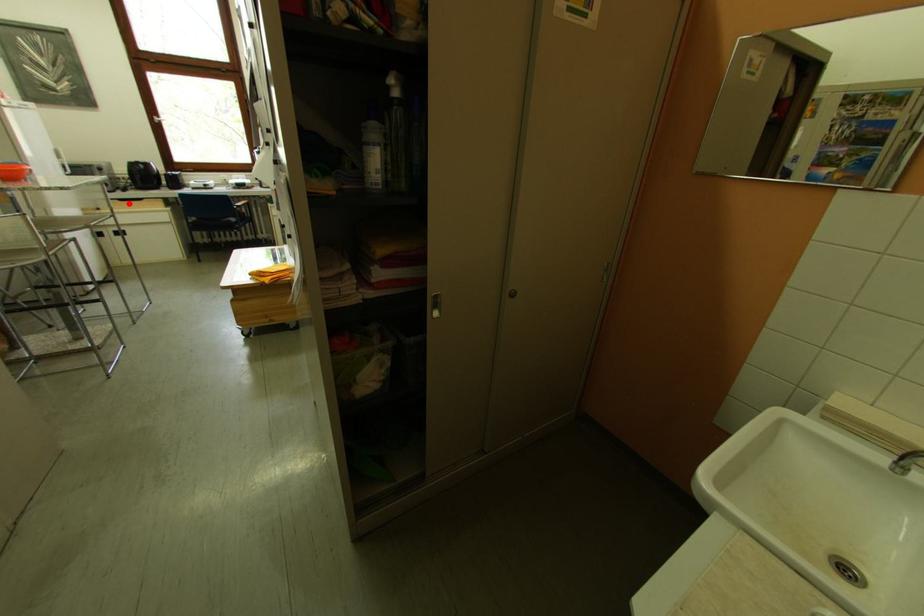
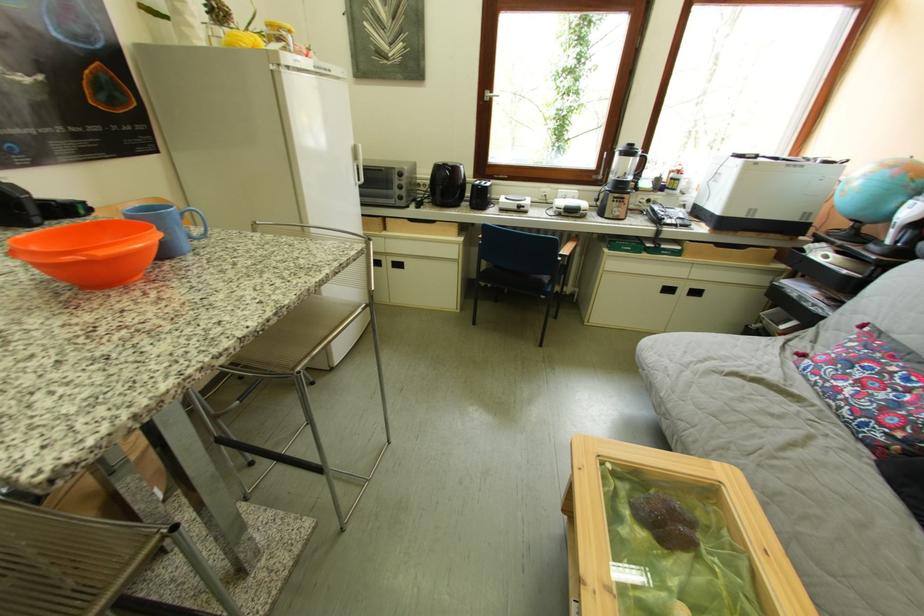
Where in the second image is the point corresponding to the highlighted location from the first image?

(419, 223)